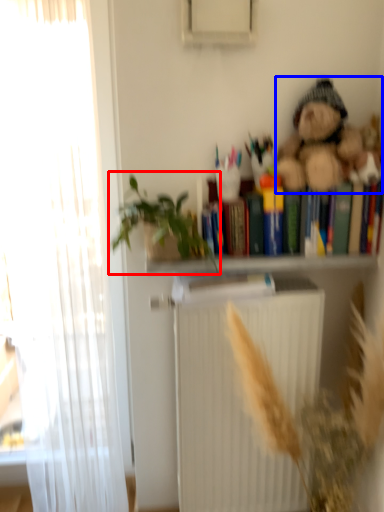
Question: Which object is further to the camera taking this photo, houseplant (highlighted by a red box) or teddy bear (highlighted by a blue box)?

Choices:
 (A) houseplant
 (B) teddy bear

Answer: (B)